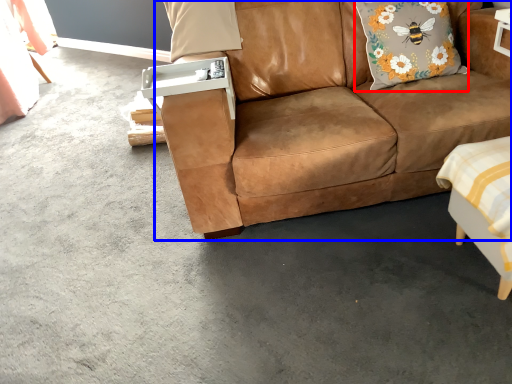
Question: Which of the following is the farthest to the observer, pillow (highlighted by a red box) or studio couch (highlighted by a blue box)?

Choices:
 (A) pillow
 (B) studio couch

Answer: (A)